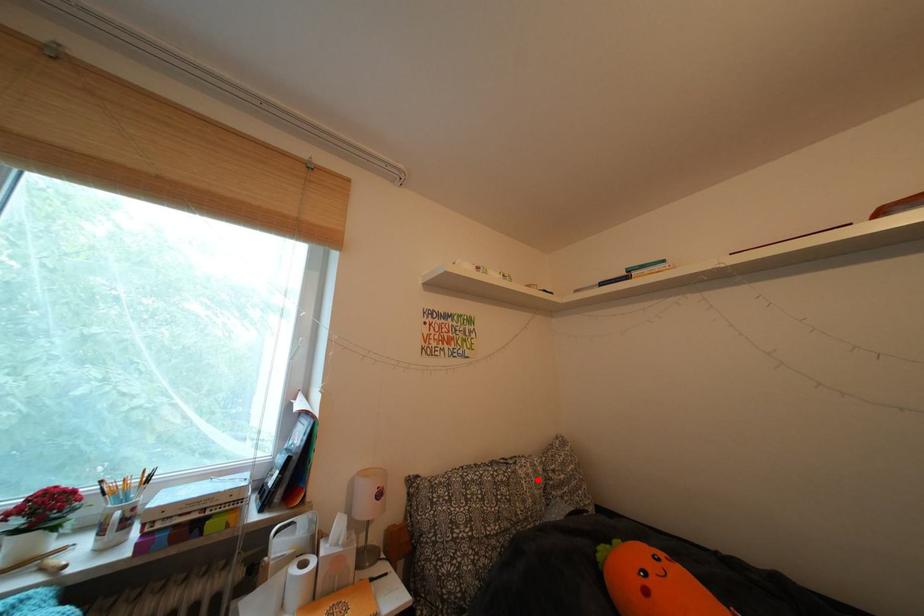
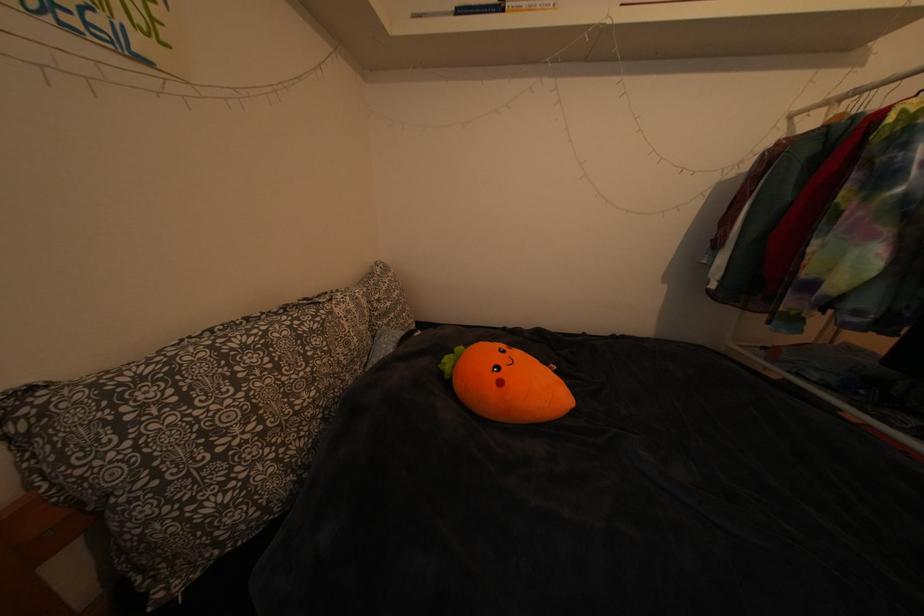
Question: I am providing you with two images of the same scene from different viewpoints. In image1, a red point is highlighted. Considering the same 3D point in image2, which of the following is correct?

Choices:
 (A) It is closer
 (B) It is farther

Answer: (A)